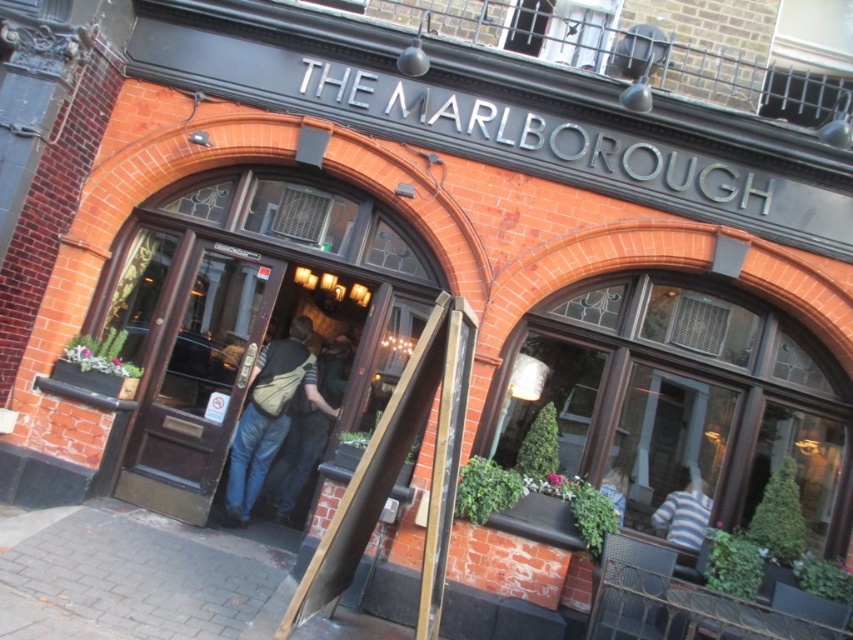
Based on the photo, who is higher up, brown wooden door at center or striped shirt at lower right?

brown wooden door at center

Is brown wooden door at center below striped shirt at lower right?

Incorrect, brown wooden door at center is not positioned below striped shirt at lower right.

Does point (274, 284) lie behind point (704, 534)?

Yes.

Where is `brown wooden door at center`? brown wooden door at center is located at coordinates (196, 378).

Does beige canvas backpack at center have a greater width compared to tan fabric backpack at center?

Indeed, beige canvas backpack at center has a greater width compared to tan fabric backpack at center.

What do you see at coordinates (270, 413) in the screenshot?
I see `beige canvas backpack at center` at bounding box center [270, 413].

Is point (238, 509) positioned after point (317, 369)?

No, it is in front of (317, 369).

At what (x,y) coordinates should I click in order to perform the action: click on beige canvas backpack at center. Please return your answer as a coordinate pair (x, y). Looking at the image, I should click on (270, 413).

Find the location of `brown wooden door at center`. brown wooden door at center is located at coordinates (196, 378).

Is brown wooden door at center to the right of beige canvas backpack at center from the viewer's perspective?

Incorrect, brown wooden door at center is not on the right side of beige canvas backpack at center.

Is point (202, 518) positioned before point (260, 408)?

Yes.

Identify the location of brown wooden door at center. (196, 378).